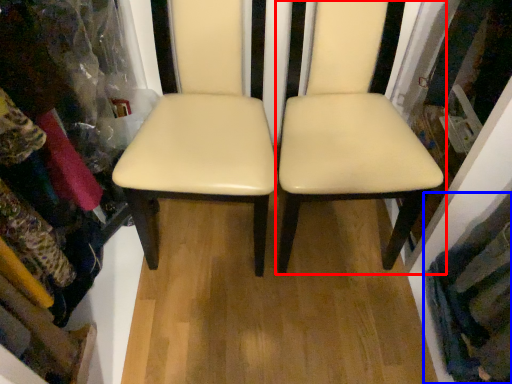
Question: Among these objects, which one is farthest to the camera, chair (highlighted by a red box) or clothing (highlighted by a blue box)?

Choices:
 (A) chair
 (B) clothing

Answer: (B)